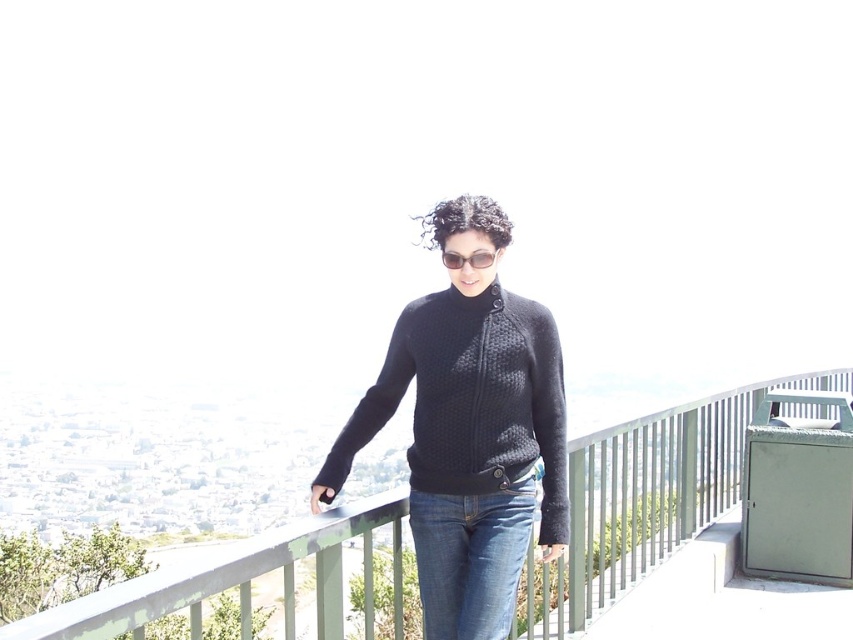
You are a fashion designer observing a model wearing a matte black sweater at center and denim jeans at center. You need to create a matching accessory that can be worn between these two items. Considering their distance, what is the minimum length your accessory should be?

The matte black sweater at center and denim jeans at center are 28.48 meters apart from each other, so the accessory should be at least 28.48 meters long to bridge the gap between them.

You are a drone operator tasked with delivering a package to a person standing on a balcony. The drone has a maximum flight range of 100 meters. You need to land the drone on the balcony near the matte black sweater at center. Considering the green metal railing at center is in the way, can the drone safely land within the 100 meter range?

The distance between the matte black sweater at center and the green metal railing at center is 80.53 meters. Since the drone can fly up to 100 meters, it has enough range to safely land near the matte black sweater at center while avoiding the green metal railing at center.